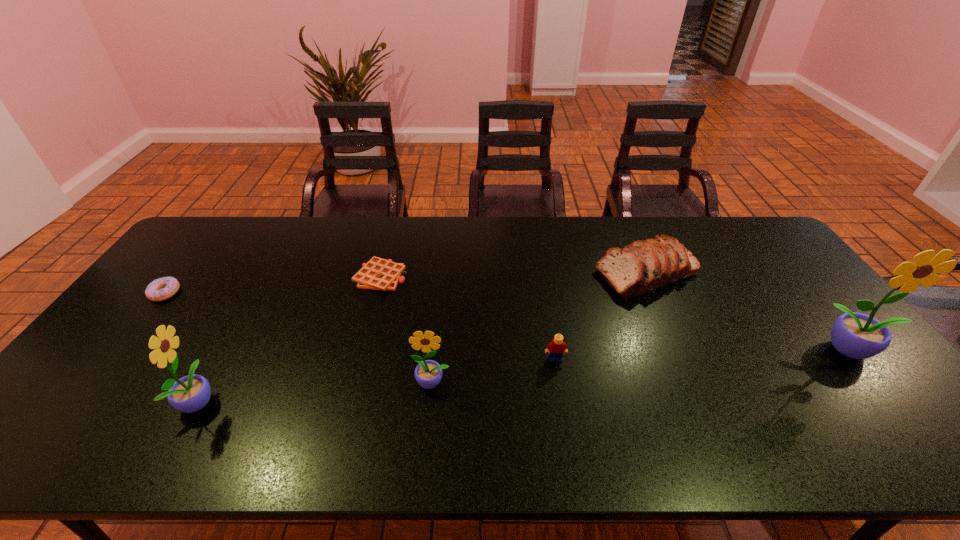
Locate an element on the screen. vacant area that lies between the fifth shortest object and the third object from right to left is located at coordinates (493, 371).

The image size is (960, 540). What are the coordinates of `vacant space that's between the fourth tallest object and the second sunflower from right to left` in the screenshot? It's located at coord(539,327).

Find the location of a particular element. vacant point located between the third tallest object and the farthest sunflower is located at coordinates (642, 366).

Where is `unoccupied position between the third object from left to right and the bread`? Image resolution: width=960 pixels, height=540 pixels. unoccupied position between the third object from left to right and the bread is located at coordinates (514, 274).

Where is `free spot between the leftmost object and the second object from right to left`? free spot between the leftmost object and the second object from right to left is located at coordinates 405,282.

I want to click on vacant area that lies between the Lego and the doughnut, so click(360, 326).

Locate an element on the screen. This screenshot has width=960, height=540. free point between the doughnut and the waffle is located at coordinates (273, 285).

Find the location of a particular element. This screenshot has width=960, height=540. the second closest object relative to the Lego is located at coordinates tap(642, 266).

At what (x,y) coordinates should I click in order to perform the action: click on object that is the second closest one to the fourth tallest object. Please return your answer as a coordinate pair (x, y). The height and width of the screenshot is (540, 960). Looking at the image, I should click on (556, 348).

Choose which sunflower is the third nearest neighbor to the fifth object from right to left. Please provide its 2D coordinates. Your answer should be formatted as a tuple, i.e. [(x, y)], where the tuple contains the x and y coordinates of a point satisfying the conditions above.

[(855, 335)]